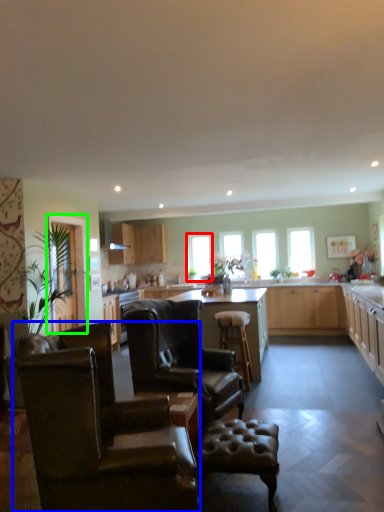
Question: Which is nearer to the window (highlighted by a red box)? chair (highlighted by a blue box) or glass door (highlighted by a green box).

Choices:
 (A) chair
 (B) glass door

Answer: (B)